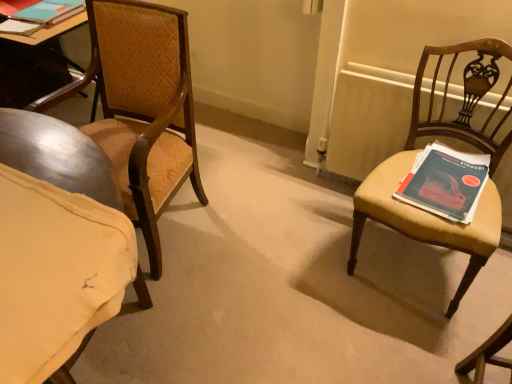
The height and width of the screenshot is (384, 512). Identify the location of vacant space that's between wooden textured chair at left, acting as the 1th chair starting from the left, and matte brown chair at right, which is the first chair in right-to-left order. (273, 248).